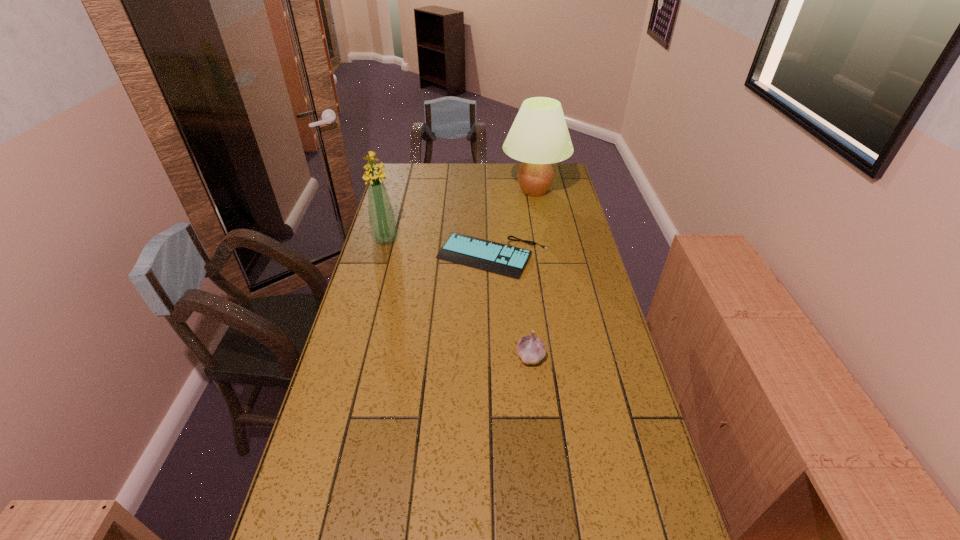
Where is `lampshade`? Image resolution: width=960 pixels, height=540 pixels. lampshade is located at coordinates (539, 136).

At what (x,y) coordinates should I click in order to perform the action: click on the leftmost object. Please return your answer as a coordinate pair (x, y). This screenshot has height=540, width=960. Looking at the image, I should click on (382, 223).

The width and height of the screenshot is (960, 540). What are the coordinates of `the second shortest object` in the screenshot? It's located at (531, 349).

Where is `the nearest object`? This screenshot has width=960, height=540. the nearest object is located at coordinates (531, 349).

Identify the location of computer keyboard. The width and height of the screenshot is (960, 540). tap(498, 258).

This screenshot has height=540, width=960. Find the location of `free space located 0.370m on the shade of the lampshade`. free space located 0.370m on the shade of the lampshade is located at coordinates (420, 191).

At what (x,y) coordinates should I click in order to perform the action: click on vacant area located 0.390m on the shade of the lampshade. Please return your answer as a coordinate pair (x, y). Image resolution: width=960 pixels, height=540 pixels. Looking at the image, I should click on (416, 191).

Locate an element on the screen. This screenshot has width=960, height=540. free space located 0.090m on the shade of the lampshade is located at coordinates (481, 191).

Where is `blank space located 0.060m on the front-facing side of the leftmost object`? blank space located 0.060m on the front-facing side of the leftmost object is located at coordinates (380, 257).

Find the location of a particular element. Image resolution: width=960 pixels, height=540 pixels. vacant space located 0.090m on the back of the garlic is located at coordinates (527, 322).